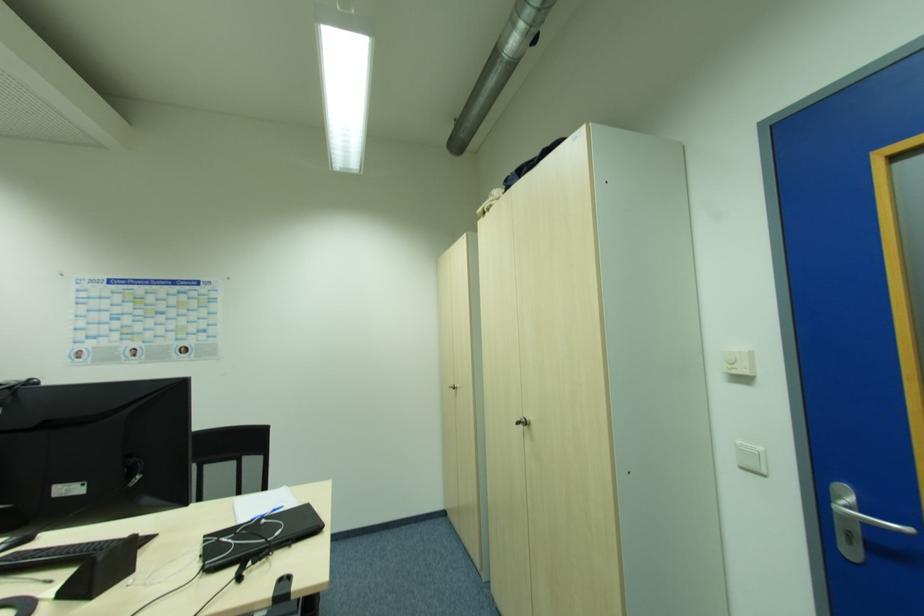
Where would you push the white light switch? Please return your answer as a coordinate pair (x, y).

(750, 458)